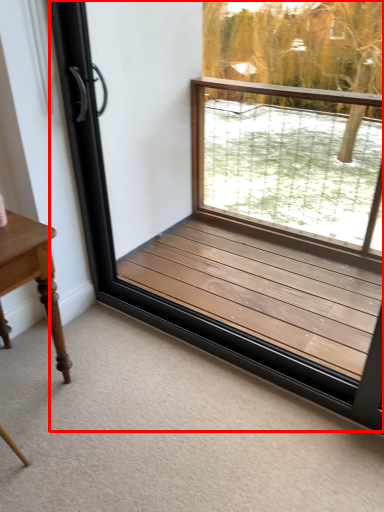
Question: From the image's perspective, what is the correct spatial positioning of window frame (annotated by the red box) in reference to table?

Choices:
 (A) above
 (B) below

Answer: (A)